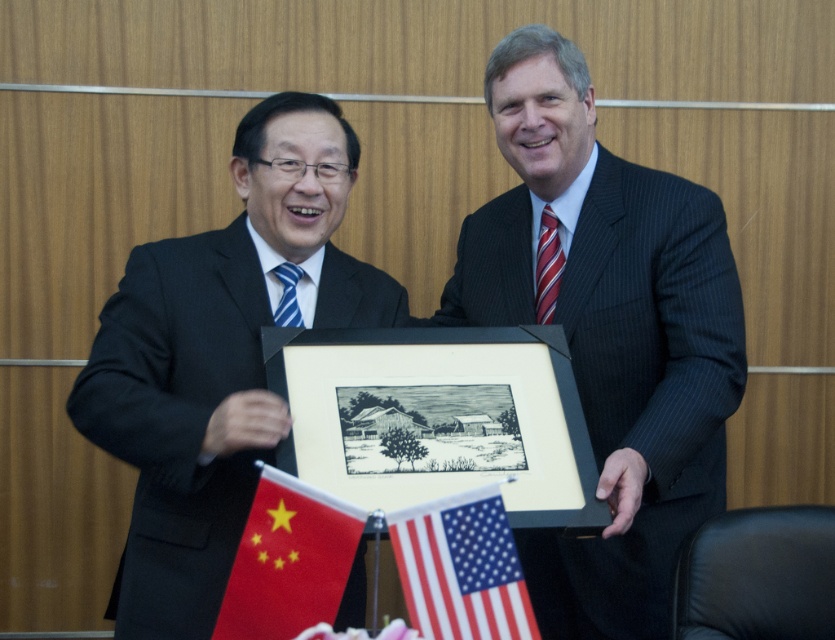
Is point (464, 452) closer to camera compared to point (502, 634)?

No, (464, 452) is further to viewer.

Who is positioned more to the right, black matte picture frame at center or silky fabric flag at lower center?

Positioned to the right is silky fabric flag at lower center.

Describe the element at coordinates (438, 417) in the screenshot. The width and height of the screenshot is (835, 640). I see `black matte picture frame at center` at that location.

The height and width of the screenshot is (640, 835). I want to click on black matte picture frame at center, so click(438, 417).

Does black pinstripe suit at left come behind silky fabric flag at lower center?

Yes, it is.

Can you confirm if black pinstripe suit at left is thinner than silky fabric flag at lower center?

Incorrect, black pinstripe suit at left's width is not less than silky fabric flag at lower center's.

At what (x,y) coordinates should I click in order to perform the action: click on black pinstripe suit at left. Please return your answer as a coordinate pair (x, y). This screenshot has width=835, height=640. Looking at the image, I should click on (176, 420).

Locate an element on the screen. black pinstripe suit at left is located at coordinates (176, 420).

Does pinstriped dark suit at center lie in front of red fabric flag at lower left?

No, pinstriped dark suit at center is further to the viewer.

Does pinstriped dark suit at center appear on the left side of red fabric flag at lower left?

In fact, pinstriped dark suit at center is to the right of red fabric flag at lower left.

Is point (649, 580) farther from viewer compared to point (246, 632)?

Yes, point (649, 580) is farther from viewer.

Identify the location of pinstriped dark suit at center. (641, 392).